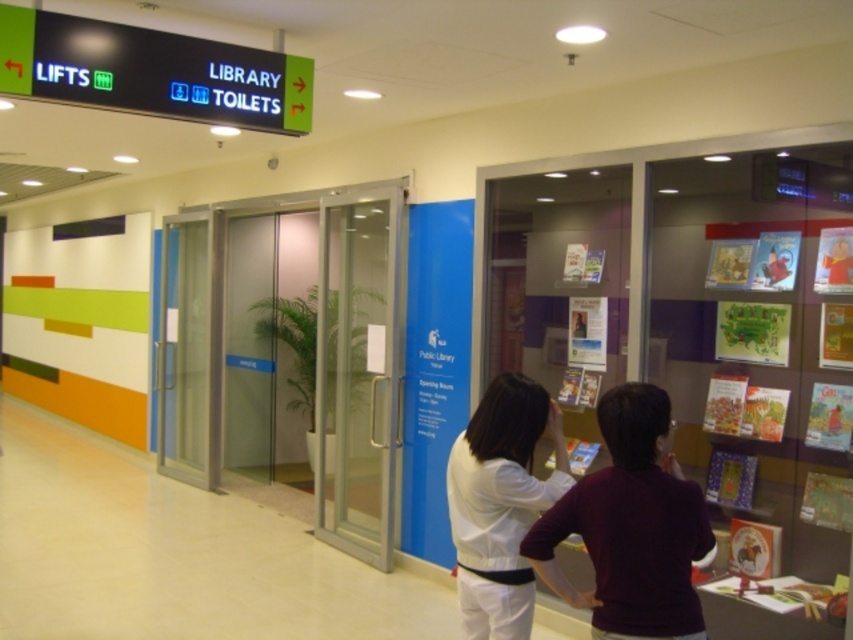
Question: Which point is closer to the camera taking this photo?

Choices:
 (A) pyautogui.click(x=618, y=442)
 (B) pyautogui.click(x=323, y=384)

Answer: (A)

Question: Can you confirm if transparent glass elevator at center is positioned above white matte shirt at center?

Choices:
 (A) no
 (B) yes

Answer: (B)

Question: Which point is closer to the camera taking this photo?

Choices:
 (A) (619, 426)
 (B) (366, 356)

Answer: (A)

Question: Which object is closer to the camera taking this photo?

Choices:
 (A) white matte shirt at center
 (B) maroon sweater at center
 (C) transparent glass elevator at center

Answer: (B)

Question: Is transparent glass elevator at center smaller than white matte shirt at center?

Choices:
 (A) yes
 (B) no

Answer: (B)

Question: Is transparent glass elevator at center in front of white matte shirt at center?

Choices:
 (A) no
 (B) yes

Answer: (A)